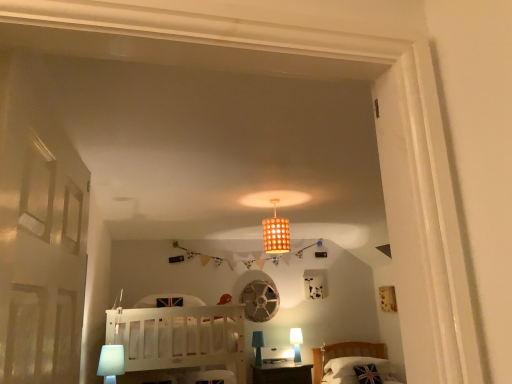
Question: Is white plastic table lamp at lower left, arranged as the third table lamp when ordered from the bottom, inside union jack fabric pillow at lower right?

Choices:
 (A) no
 (B) yes

Answer: (A)

Question: From a real-world perspective, does union jack fabric pillow at lower right sit lower than white plastic table lamp at lower left, placed as the first table lamp when sorted from front to back?

Choices:
 (A) no
 (B) yes

Answer: (B)

Question: Is union jack fabric pillow at lower right to the left of white plastic table lamp at lower left, which is counted as the first table lamp, starting from the left, from the viewer's perspective?

Choices:
 (A) yes
 (B) no

Answer: (B)

Question: Is union jack fabric pillow at lower right outside white plastic table lamp at lower left, the 3th table lamp from the right?

Choices:
 (A) no
 (B) yes

Answer: (B)

Question: Does union jack fabric pillow at lower right have a larger size compared to white plastic table lamp at lower left, placed as the first table lamp when sorted from front to back?

Choices:
 (A) yes
 (B) no

Answer: (A)

Question: From their relative heights in the image, would you say union jack fabric pillow at lower right is taller or shorter than wooden lampshade at center?

Choices:
 (A) tall
 (B) short

Answer: (B)

Question: In the image, is union jack fabric pillow at lower right on the left side or the right side of wooden lampshade at center?

Choices:
 (A) right
 (B) left

Answer: (A)

Question: Based on their sizes in the image, would you say union jack fabric pillow at lower right is bigger or smaller than wooden lampshade at center?

Choices:
 (A) small
 (B) big

Answer: (B)

Question: From a real-world perspective, relative to wooden lampshade at center, is union jack fabric pillow at lower right vertically above or below?

Choices:
 (A) above
 (B) below

Answer: (B)

Question: Considering their positions, is wooden lampshade at center located in front of or behind white plastic table lamp at lower left, arranged as the third table lamp when ordered from the bottom?

Choices:
 (A) front
 (B) behind

Answer: (B)

Question: Visually, is wooden lampshade at center positioned to the left or to the right of white plastic table lamp at lower left, placed as the first table lamp when sorted from front to back?

Choices:
 (A) left
 (B) right

Answer: (B)

Question: Is wooden lampshade at center bigger or smaller than white plastic table lamp at lower left, which appears as the 1th table lamp when viewed from the top?

Choices:
 (A) big
 (B) small

Answer: (A)

Question: Is wooden lampshade at center inside or outside of white plastic table lamp at lower left, which appears as the 1th table lamp when viewed from the top?

Choices:
 (A) outside
 (B) inside

Answer: (A)

Question: Is blue fabric table lamp at lower center, placed as the 2th table lamp when sorted from top to bottom, in front of or behind white plastic table lamp at lower left, placed as the first table lamp when sorted from front to back, in the image?

Choices:
 (A) front
 (B) behind

Answer: (B)

Question: In terms of width, does blue fabric table lamp at lower center, positioned as the second table lamp in left-to-right order, look wider or thinner when compared to white plastic table lamp at lower left, arranged as the third table lamp when viewed from the back?

Choices:
 (A) thin
 (B) wide

Answer: (A)